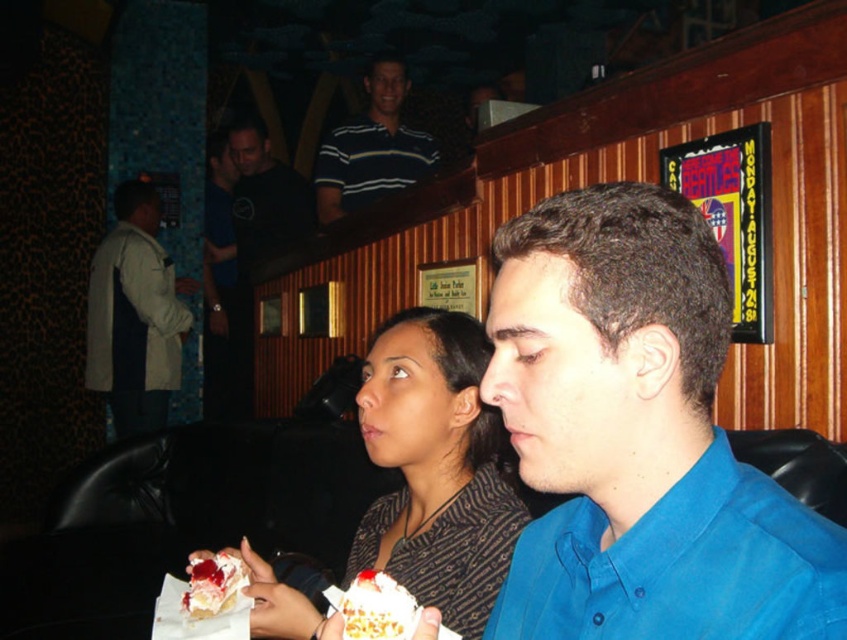
Consider the image. You are a photographer standing at the camera position in the scene. You want to take a photo of the matte brown dress at center. Is the distance between you and the dress sufficient to capture a clear, focused image with your standard lens? Assume your standard lens has a minimum focusing distance of 3 feet.

The matte brown dress at center and camera are 3.51 feet apart, which is greater than the minimum focusing distance of 3 feet. Therefore, the distance is sufficient to capture a clear, focused image with your standard lens.

You are a photographer taking a picture of the matte brown dress at center and the black cotton shirt at upper center. Which one should you focus on first if you want to capture both in the frame without moving the camera?

The matte brown dress at center is positioned on the right side of black cotton shirt at upper center, so you should focus on the black cotton shirt at upper center first to ensure both are in frame without moving the camera.

You are a photographer trying to capture the striped polo shirt at upper center and the white frosted cake at center in a single frame. Based on their positions, which object should you adjust your camera to focus on first to ensure both are in the shot?

The striped polo shirt at upper center is positioned on the left side of white frosted cake at center, so you should focus on the white frosted cake at center first as it is closer to the center of the frame, ensuring both objects are included.